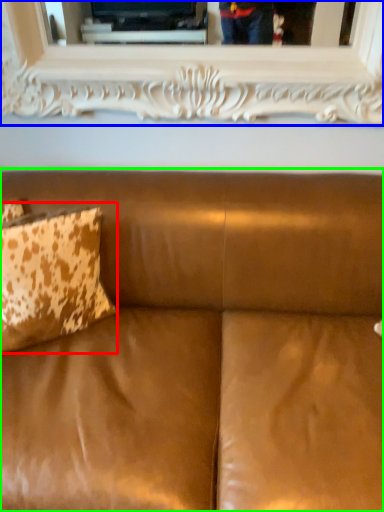
Question: Estimate the real-world distances between objects in this image. Which object is farther from pillow (highlighted by a red box), picture frame (highlighted by a blue box) or studio couch (highlighted by a green box)?

Choices:
 (A) picture frame
 (B) studio couch

Answer: (A)